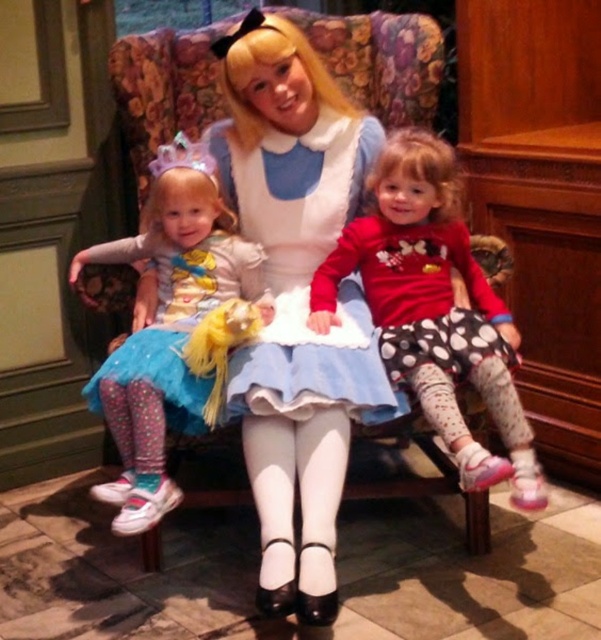
Does polka dot leggings at center have a lesser width compared to blue tulle skirt at left?

No.

Does point (320, 300) lie in front of point (165, 349)?

No, it is not.

Which is behind, point (426, 236) or point (177, 349)?

Positioned behind is point (426, 236).

You are a GUI agent. You are given a task and a screenshot of the screen. Output one action in this format:
    pyautogui.click(x=<x>, y=<y>)
    Task: Click on the polka dot leggings at center
    The height and width of the screenshot is (640, 601).
    Given the screenshot: What is the action you would take?
    pyautogui.click(x=433, y=308)

In the scene shown: Is floral fabric armchair at center to the right of blue tulle skirt at left from the viewer's perspective?

Yes, floral fabric armchair at center is to the right of blue tulle skirt at left.

Between floral fabric armchair at center and blue tulle skirt at left, which one appears on the left side from the viewer's perspective?

From the viewer's perspective, blue tulle skirt at left appears more on the left side.

Does point (212, 150) lie behind point (221, 291)?

Yes, it is behind point (221, 291).

The height and width of the screenshot is (640, 601). In order to click on floral fabric armchair at center in this screenshot , I will do `click(347, 394)`.

Between floral fabric armchair at center and pastel polka dot leggings at left, which one is positioned lower?

pastel polka dot leggings at left is lower down.

Measure the distance between floral fabric armchair at center and pastel polka dot leggings at left.

floral fabric armchair at center is 10.43 inches from pastel polka dot leggings at left.

Which is in front, point (239, 499) or point (174, 390)?

Positioned in front is point (174, 390).

The image size is (601, 640). What are the coordinates of `floral fabric armchair at center` in the screenshot? It's located at (347, 394).